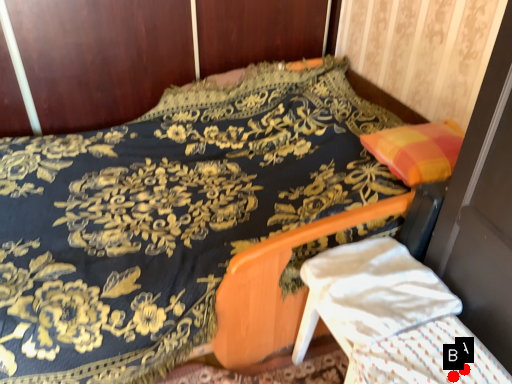
Question: Two points are circled on the image, labeled by A and B beside each circle. Among these points, which one is farthest from the camera?

Choices:
 (A) A is further
 (B) B is further

Answer: (A)